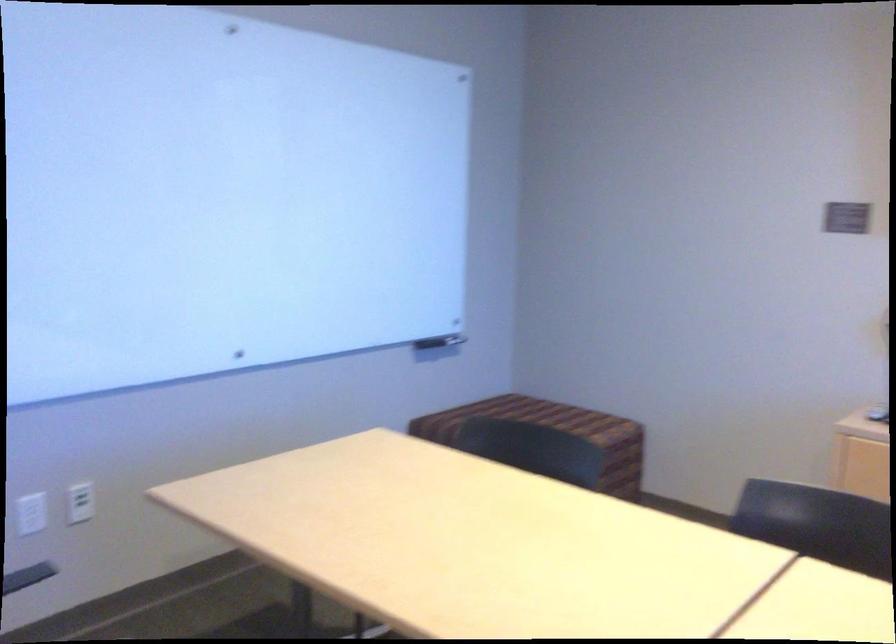
Image resolution: width=896 pixels, height=644 pixels. Find the location of `sofa sitting surface`. sofa sitting surface is located at coordinates (607, 482).